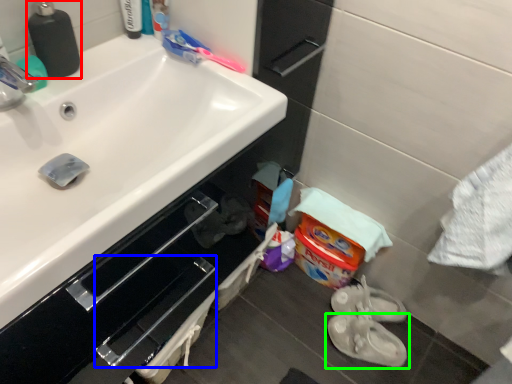
Question: Which object is the farthest from soap dispenser (highlighted by a red box)? Choose among these: drawer (highlighted by a blue box) or footwear (highlighted by a green box).

Choices:
 (A) drawer
 (B) footwear

Answer: (B)